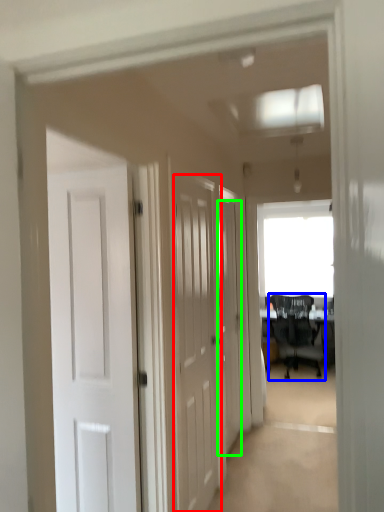
Question: Which object is positioned closest to door (highlighted by a red box)? Select from chair (highlighted by a blue box) and door (highlighted by a green box).

Choices:
 (A) chair
 (B) door

Answer: (B)